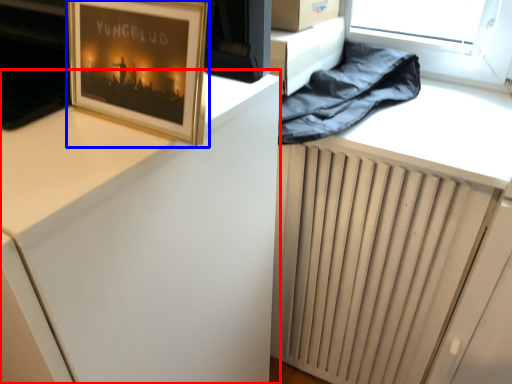
Question: Which object is further to the camera taking this photo, computer desk (highlighted by a red box) or picture frame (highlighted by a blue box)?

Choices:
 (A) computer desk
 (B) picture frame

Answer: (B)